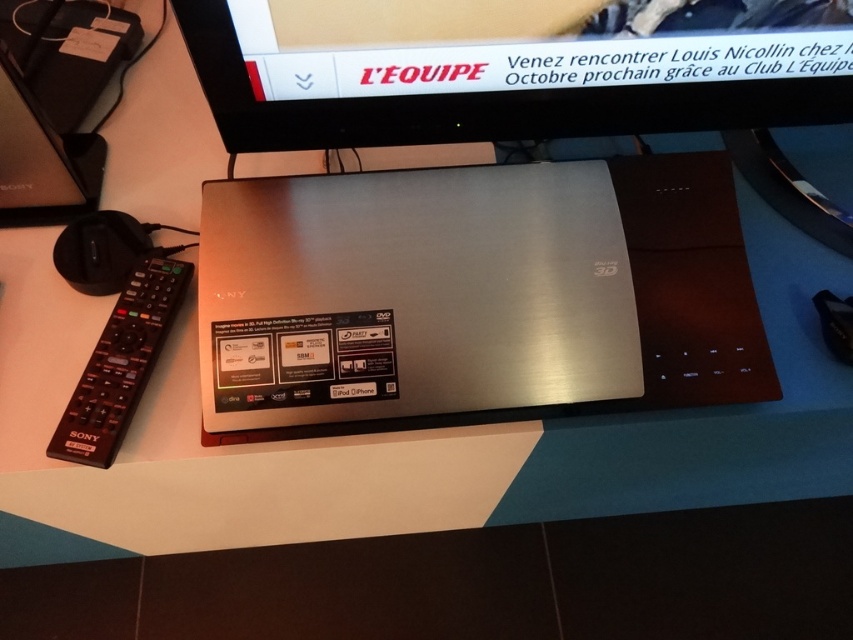
You are setting up a home theater system and need to place the satin silver monitor at upper center and the black plastic remote at left on a shelf. The shelf has a height limit of 10 cm. Can both items fit vertically on the shelf without exceeding the height limit?

The satin silver monitor at upper center is shorter than the black plastic remote at left. Since the shelf has a height limit of 10 cm, both items can fit vertically as long as the tallest item, the black plastic remote at left, is under 10 cm. However, without specific height measurements, we cannot confirm if the black plastic remote at left is within the limit.

You are holding a satin silver laptop at center and want to place it on a desk. The desk is 24 inches wide. Will the laptop fit on the desk without overhanging?

The satin silver laptop at center is 23.78 inches wide, which is slightly less than the desk width of 24 inches. Therefore, the laptop will fit on the desk without overhanging.

You are setting up a home office and have a satin silver laptop at center and a satin silver monitor at upper center. Which object is positioned to the left of the other?

The satin silver laptop at center is to the left of the satin silver monitor at upper center.